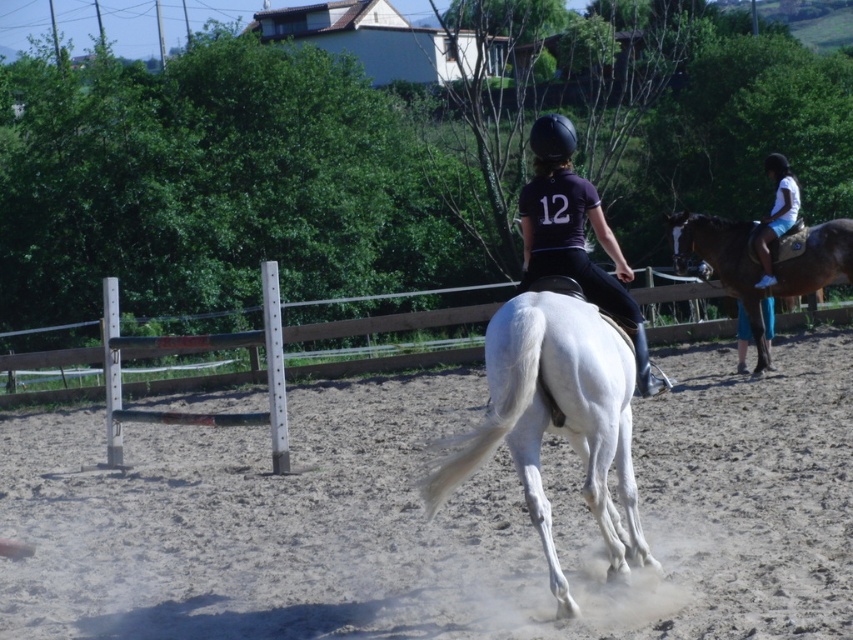
Question: Can you confirm if dusty sand at center is smaller than brown glossy horse at right?

Choices:
 (A) no
 (B) yes

Answer: (A)

Question: Is dusty sand at center positioned before white glossy horse at center?

Choices:
 (A) no
 (B) yes

Answer: (A)

Question: Which point is closer to the camera?

Choices:
 (A) dusty sand at center
 (B) white glossy horse at center
 (C) brown glossy horse at right

Answer: (B)

Question: Which point is farther from the camera taking this photo?

Choices:
 (A) (534, 163)
 (B) (708, 531)
 (C) (544, 346)

Answer: (A)

Question: Which point is closer to the camera?

Choices:
 (A) (503, 333)
 (B) (344, 464)
 (C) (531, 280)

Answer: (A)

Question: Is white glossy horse at center to the right of matte black jockey at center from the viewer's perspective?

Choices:
 (A) no
 (B) yes

Answer: (A)